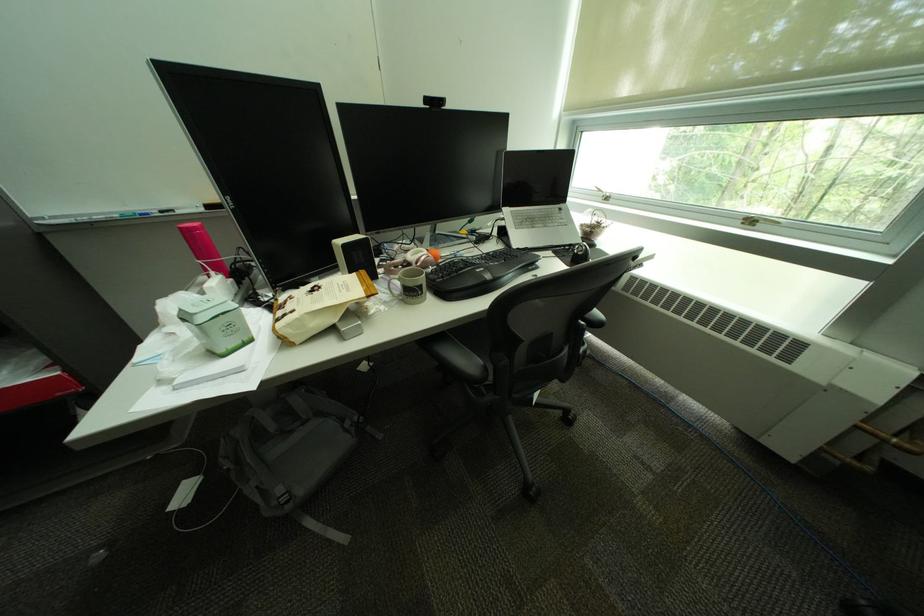
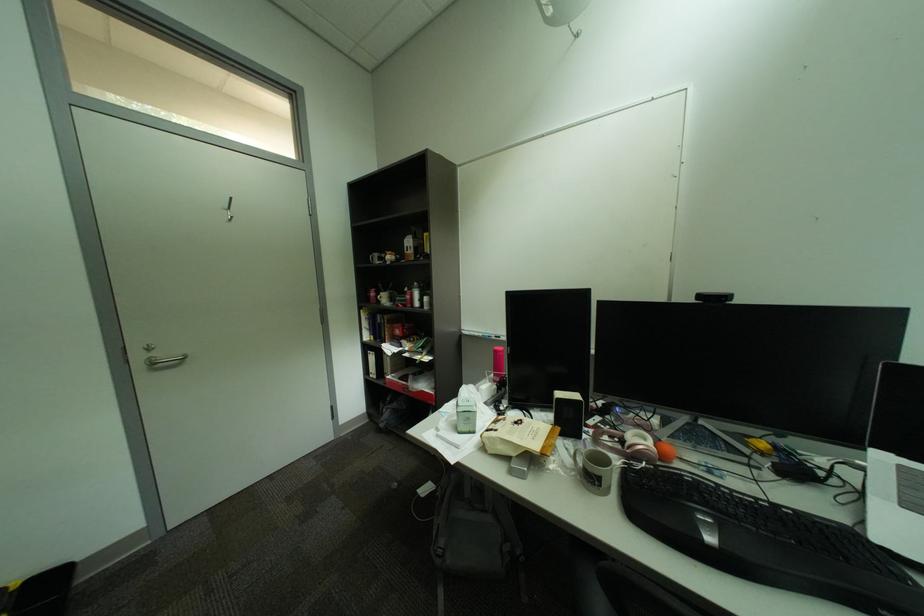
Question: How did the camera likely rotate?

Choices:
 (A) Left
 (B) Right
 (C) Up
 (D) Down

Answer: (A)